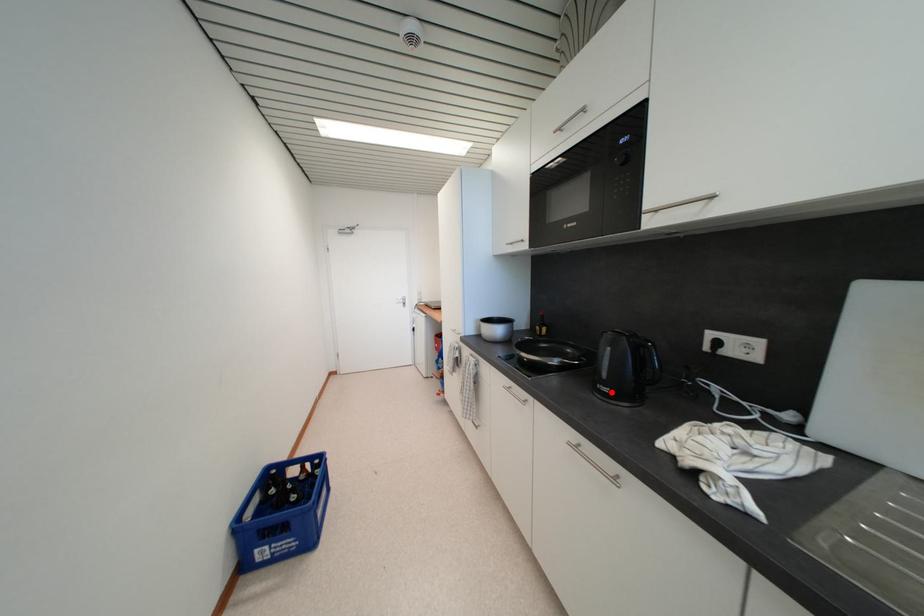
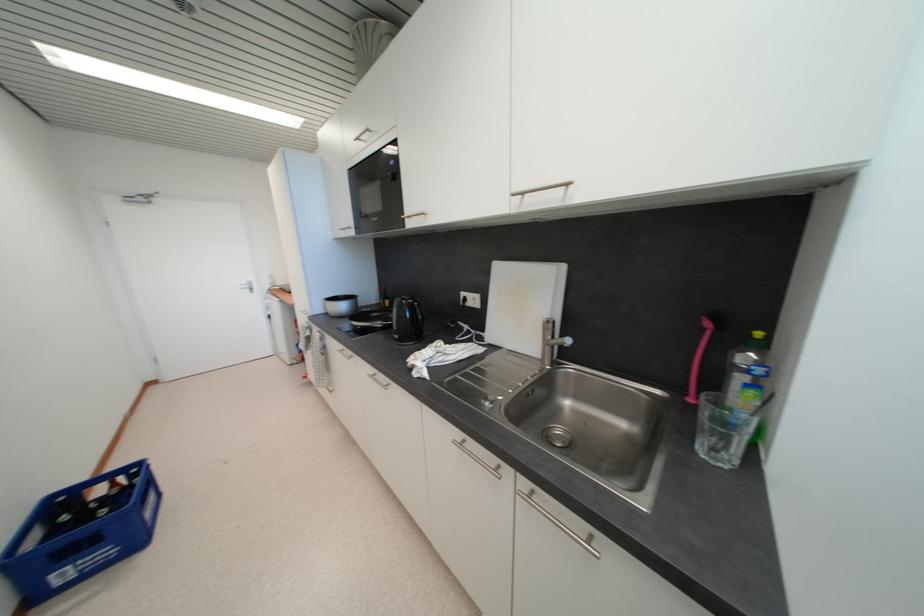
Find the pixel in the second image that matches the highlighted location in the first image.

(402, 339)